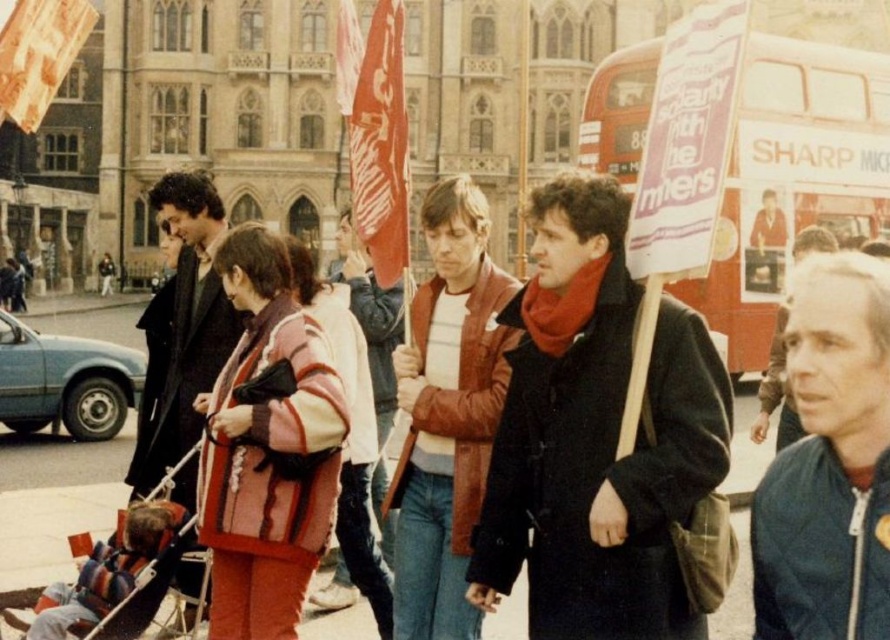
Question: Is matte black coat at center above dark brown leather coat at left?

Choices:
 (A) no
 (B) yes

Answer: (A)

Question: Which point is farther to the camera?

Choices:
 (A) matte black coat at center
 (B) dark brown leather coat at left
 (C) red double-decker bus at center

Answer: (B)

Question: Is matte black coat at center to the right of dark brown leather coat at left from the viewer's perspective?

Choices:
 (A) no
 (B) yes

Answer: (B)

Question: Among these objects, which one is farthest from the camera?

Choices:
 (A) red double-decker bus at center
 (B) matte black coat at center
 (C) dark brown leather coat at left

Answer: (C)

Question: Which point is farther from the camera taking this photo?

Choices:
 (A) (530, 561)
 (B) (822, 116)

Answer: (B)

Question: Does matte black coat at center have a greater width compared to red double-decker bus at center?

Choices:
 (A) yes
 (B) no

Answer: (B)